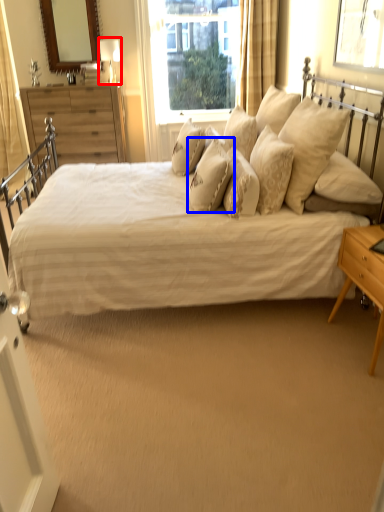
Question: Which object is closer to the camera taking this photo, table lamp (highlighted by a red box) or pillow (highlighted by a blue box)?

Choices:
 (A) table lamp
 (B) pillow

Answer: (B)